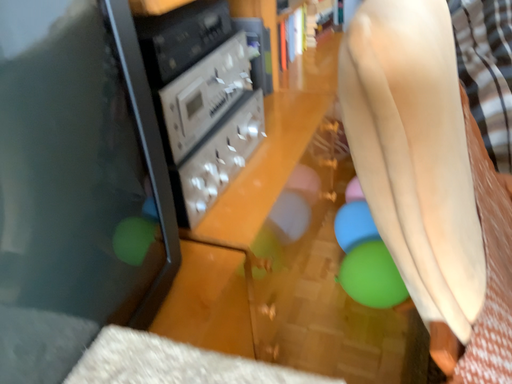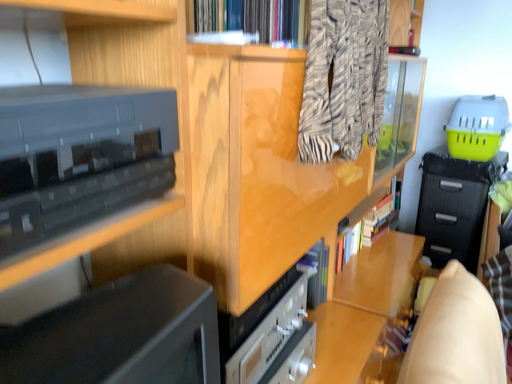
Question: How did the camera likely rotate when shooting the video?

Choices:
 (A) rotated downward
 (B) rotated upward

Answer: (B)